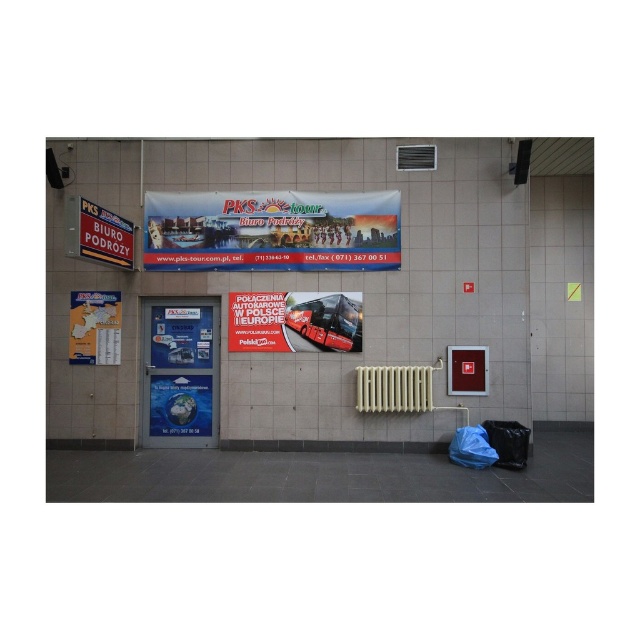
Is point (209, 406) in front of point (96, 294)?

No, (209, 406) is further to viewer.

Describe the element at coordinates (180, 404) in the screenshot. The image size is (640, 640). I see `blue glossy poster at center` at that location.

Does point (202, 374) come in front of point (108, 352)?

No, it is behind (108, 352).

Locate an element on the screen. This screenshot has height=640, width=640. blue glossy poster at center is located at coordinates (180, 404).

Who is more distant from viewer, (177, 376) or (156, 330)?

Positioned behind is point (156, 330).

Can you confirm if blue glossy poster at center is wider than matte plastic sign at center?

Yes, blue glossy poster at center is wider than matte plastic sign at center.

This screenshot has width=640, height=640. I want to click on blue glossy poster at center, so click(180, 404).

Where is `matte plastic sign at center`? matte plastic sign at center is located at coordinates click(180, 337).

Does point (211, 340) lie behind point (80, 356)?

Yes, point (211, 340) is farther from viewer.

Where is `matte plastic sign at center`? This screenshot has height=640, width=640. matte plastic sign at center is located at coordinates (180, 337).